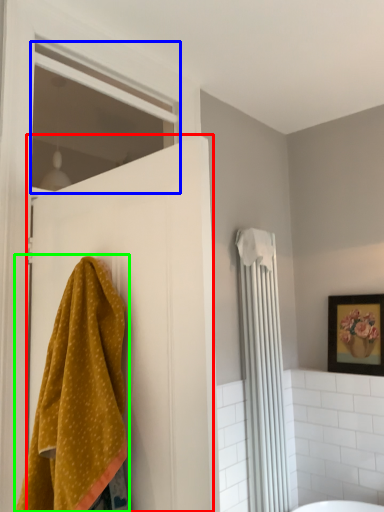
Question: Considering the real-world distances, which object is closest to door (highlighted by a red box)? window (highlighted by a blue box) or towel (highlighted by a green box).

Choices:
 (A) window
 (B) towel

Answer: (B)